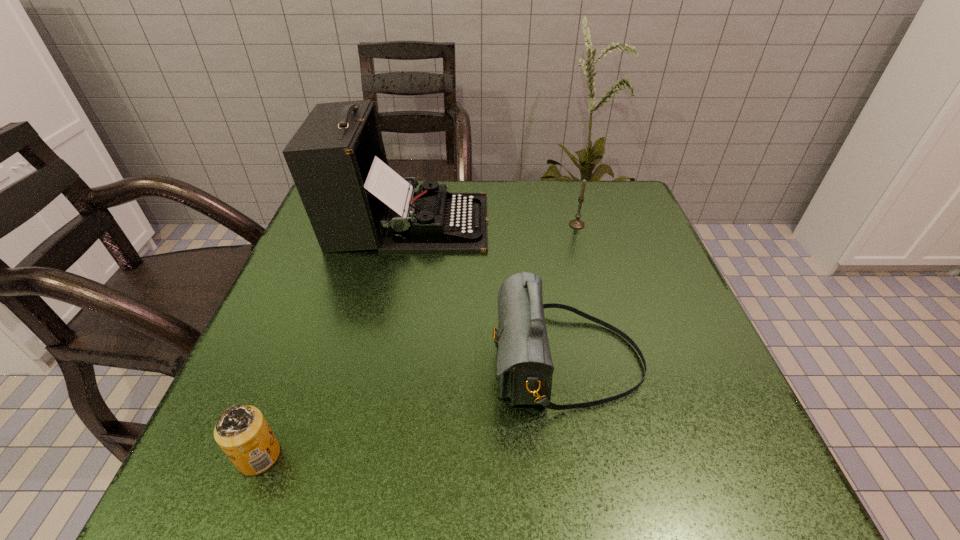
Find the location of a particular element. The width and height of the screenshot is (960, 540). typewriter is located at coordinates (354, 201).

This screenshot has height=540, width=960. What are the coordinates of `shoulder bag` in the screenshot? It's located at (524, 363).

This screenshot has height=540, width=960. In order to click on the second tallest object in this screenshot , I will do `click(524, 363)`.

At what (x,y) coordinates should I click in order to perform the action: click on candle. Please return your answer as a coordinate pair (x, y). Looking at the image, I should click on (575, 223).

Locate an element on the screen. The image size is (960, 540). the nearest object is located at coordinates (241, 431).

Find the location of a particular element. Image resolution: width=960 pixels, height=540 pixels. beer can is located at coordinates (241, 431).

Image resolution: width=960 pixels, height=540 pixels. In order to click on vacant space located inside the open case of the tallest object in this screenshot , I will do `click(616, 222)`.

Where is `vacant area located 0.300m on the left of the second tallest object`? This screenshot has height=540, width=960. vacant area located 0.300m on the left of the second tallest object is located at coordinates (318, 361).

The image size is (960, 540). Find the location of `vacant space located 0.400m on the front of the third tallest object`. vacant space located 0.400m on the front of the third tallest object is located at coordinates (616, 367).

This screenshot has height=540, width=960. In order to click on free spot located 0.270m on the back of the nearest object in this screenshot , I will do [316, 307].